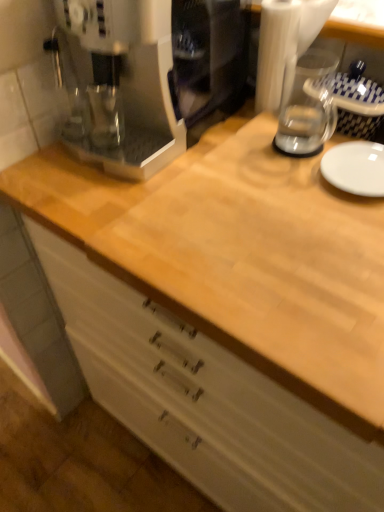
Identify the location of free space in front of white glossy plate at right. This screenshot has width=384, height=512. tap(342, 240).